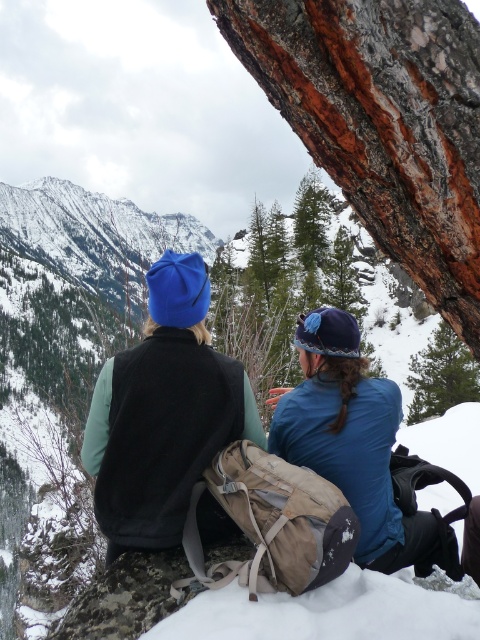
You are a photographer trying to capture a landscape shot of the snow mountains. You notice the matte blue beanie at upper left and the green textured pine tree at upper right in your frame. Which object should you adjust your focus to ensure the mountains are in the background? Explain your reasoning.

The matte blue beanie at upper left is closer to the viewer than the green textured pine tree at upper right. To ensure the mountains are in the background, you should focus on the green textured pine tree at upper right because it is farther away, aligning with the mountains in the distance.

From the picture: You are an observer looking at the snowy landscape. You notice the matte blue beanie at upper left and the green textured pine tree at upper right. Which object is taller?

The matte blue beanie at upper left is much taller than the green textured pine tree at upper right.